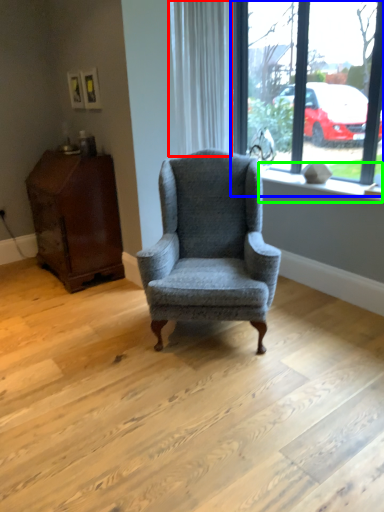
Question: Which object is positioned closest to curtain (highlighted by a red box)? Select from window (highlighted by a blue box) and window sill (highlighted by a green box).

Choices:
 (A) window
 (B) window sill

Answer: (A)